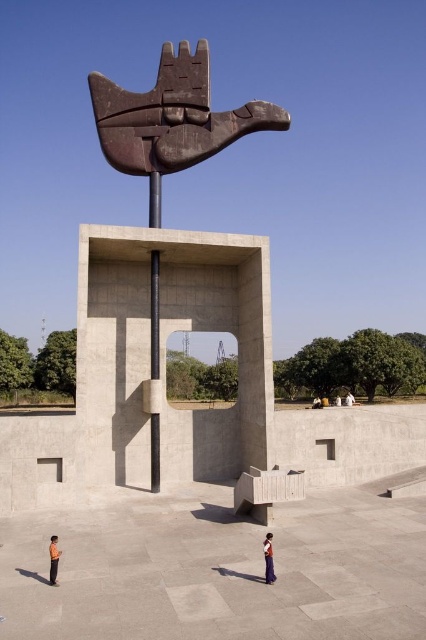
Question: Is light brown wooden bench at center further to the viewer compared to dark brown leather jacket at center?

Choices:
 (A) yes
 (B) no

Answer: (B)

Question: Which object appears closest to the camera in this image?

Choices:
 (A) orange fabric pants at center
 (B) orange shirt at lower left

Answer: (A)

Question: Is dark brown polished hand at center further to camera compared to orange shirt at lower left?

Choices:
 (A) no
 (B) yes

Answer: (B)

Question: Which point is farther to the camera?

Choices:
 (A) white stone person at center
 (B) orange fabric pants at center
 (C) orange shirt at lower left

Answer: (A)

Question: Is orange fabric pants at center bigger than white stone person at center?

Choices:
 (A) no
 (B) yes

Answer: (A)

Question: Which point appears closest to the camera in this image?

Choices:
 (A) (350, 397)
 (B) (137, 129)
 (C) (339, 394)
 (D) (270, 577)

Answer: (D)